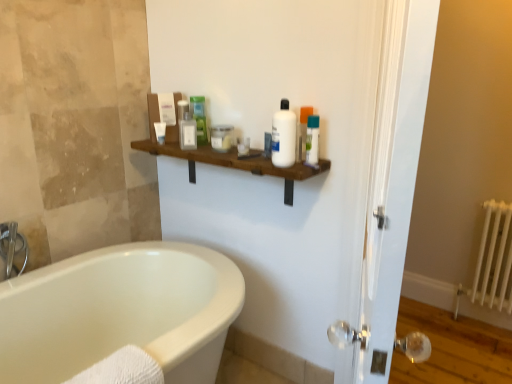
Where is `translucent plastic cup at center, placed as the 3th toiletry when sorted from right to left`? Image resolution: width=512 pixels, height=384 pixels. translucent plastic cup at center, placed as the 3th toiletry when sorted from right to left is located at coordinates (243, 147).

I want to click on white matte tube at upper center, positioned as the 8th toiletry in right-to-left order, so click(160, 132).

What do you see at coordinates (267, 144) in the screenshot? This screenshot has height=384, width=512. I see `translucent plastic bottle at center, positioned as the 2th toiletry in right-to-left order` at bounding box center [267, 144].

This screenshot has width=512, height=384. What are the coordinates of `translucent plastic bottle at center, positioned as the 2th toiletry in right-to-left order` in the screenshot? It's located at (267, 144).

This screenshot has width=512, height=384. What do you see at coordinates (492, 261) in the screenshot? I see `white metal radiator at right` at bounding box center [492, 261].

In order to face matte plastic container at upper center, the seventh toiletry in the right-to-left sequence, should I rotate leftwards or rightwards?

It's best to rotate left around 9.653 degrees.

Locate an element on the screen. The image size is (512, 384). translucent plastic cup at center, acting as the sixth toiletry starting from the left is located at coordinates (243, 147).

Can you confirm if white glossy screen door at right is bigger than white metal radiator at right?

→ Correct, white glossy screen door at right is larger in size than white metal radiator at right.

In the image, there is a white glossy screen door at right. At what (x,y) coordinates should I click in order to perform the action: click on radiator below it (from the image's perspective). Please return your answer as a coordinate pair (x, y). Looking at the image, I should click on (492, 261).

From a real-world perspective, between white glossy screen door at right and white metal radiator at right, who is vertically lower?

white metal radiator at right, from a real-world perspective.

Is the surface of white glossy screen door at right in direct contact with white metal radiator at right?

No, white glossy screen door at right is not in contact with white metal radiator at right.

What's the angular difference between translucent plastic cup at center, placed as the 3th toiletry when sorted from right to left, and white glossy lotion at upper center, which is counted as the first toiletry, starting from the right,'s facing directions?

There is a 0.0168-degree angle between the facing directions of translucent plastic cup at center, placed as the 3th toiletry when sorted from right to left, and white glossy lotion at upper center, which is counted as the first toiletry, starting from the right.

In terms of size, does translucent plastic cup at center, acting as the sixth toiletry starting from the left, appear bigger or smaller than white glossy lotion at upper center, which is counted as the first toiletry, starting from the right?

translucent plastic cup at center, acting as the sixth toiletry starting from the left, is smaller than white glossy lotion at upper center, which is counted as the first toiletry, starting from the right.

There is a white glossy lotion at upper center, which is counted as the first toiletry, starting from the right. Where is `the 2nd toiletry below it (from the image's perspective)`? the 2nd toiletry below it (from the image's perspective) is located at coordinates (243, 147).

Is translucent plastic cup at center, acting as the sixth toiletry starting from the left, shorter than white glossy lotion at upper center, the 8th toiletry when ordered from left to right?

Indeed, translucent plastic cup at center, acting as the sixth toiletry starting from the left, has a lesser height compared to white glossy lotion at upper center, the 8th toiletry when ordered from left to right.

From the image's perspective, between matte glass jar at center, the 5th toiletry positioned from the left, and translucent plastic bottle at center, the 7th toiletry positioned from the left, who is located below?

translucent plastic bottle at center, the 7th toiletry positioned from the left, appears lower in the image.

Is matte glass jar at center, the 5th toiletry positioned from the left, aimed at translucent plastic bottle at center, positioned as the 2th toiletry in right-to-left order?

No.

Looking at this image, from their relative heights in the image, would you say matte glass jar at center, the 5th toiletry positioned from the left, is taller or shorter than translucent plastic bottle at center, the 7th toiletry positioned from the left?

Considering their sizes, matte glass jar at center, the 5th toiletry positioned from the left, has less height than translucent plastic bottle at center, the 7th toiletry positioned from the left.

Based on the photo, would you say matte glass jar at center, the 5th toiletry positioned from the left, contains translucent plastic bottle at center, positioned as the 2th toiletry in right-to-left order?

No, matte glass jar at center, the 5th toiletry positioned from the left, does not contain translucent plastic bottle at center, positioned as the 2th toiletry in right-to-left order.

Is clear plastic container at upper center, marked as the 6th toiletry in a right-to-left arrangement, positioned with its back to brushed metal faucet at left?

clear plastic container at upper center, marked as the 6th toiletry in a right-to-left arrangement, is not turned away from brushed metal faucet at left.

This screenshot has height=384, width=512. In the image, there is a clear plastic container at upper center, marked as the 6th toiletry in a right-to-left arrangement. What are the coordinates of `faucet below it (from a real-world perspective)` in the screenshot? It's located at (12, 248).

Is brushed metal faucet at left completely or partially inside clear plastic container at upper center, marked as the 6th toiletry in a right-to-left arrangement?

Actually, brushed metal faucet at left is outside clear plastic container at upper center, marked as the 6th toiletry in a right-to-left arrangement.

Is clear plastic container at upper center, marked as the 6th toiletry in a right-to-left arrangement, at the right side of brushed metal faucet at left?

Yes, clear plastic container at upper center, marked as the 6th toiletry in a right-to-left arrangement, is to the right of brushed metal faucet at left.

Can you confirm if white glossy lotion at upper center, the 8th toiletry when ordered from left to right, is positioned to the right of white metal radiator at right?

In fact, white glossy lotion at upper center, the 8th toiletry when ordered from left to right, is to the left of white metal radiator at right.

From a real-world perspective, does white glossy lotion at upper center, the 8th toiletry when ordered from left to right, sit lower than white metal radiator at right?

No, from a real-world perspective, white glossy lotion at upper center, the 8th toiletry when ordered from left to right, is not under white metal radiator at right.

Is white glossy lotion at upper center, which is counted as the first toiletry, starting from the right, not near white metal radiator at right?

Yes.

From the image's perspective, which is below, white glossy lotion at upper center, which is counted as the first toiletry, starting from the right, or white metal radiator at right?

white metal radiator at right, from the image's perspective.

Can you confirm if white matte tube at upper center, the first toiletry when ordered from left to right, is smaller than white glossy screen door at right?

Yes, white matte tube at upper center, the first toiletry when ordered from left to right, is smaller than white glossy screen door at right.

Is point (161, 139) positioned before point (355, 192)?

No, it is behind (355, 192).

Is white matte tube at upper center, the first toiletry when ordered from left to right, in contact with white glossy screen door at right?

No, white matte tube at upper center, the first toiletry when ordered from left to right, is not beside white glossy screen door at right.

Identify the location of screen door that appears below the white matte tube at upper center, the first toiletry when ordered from left to right (from a real-world perspective). The height and width of the screenshot is (384, 512). (382, 181).

What's the angular difference between green matte tube at upper center, the fifth toiletry viewed from the right, and clear plastic container at upper center, marked as the 6th toiletry in a right-to-left arrangement,'s facing directions?

The facing directions of green matte tube at upper center, the fifth toiletry viewed from the right, and clear plastic container at upper center, marked as the 6th toiletry in a right-to-left arrangement, are 52 degrees apart.

Is green matte tube at upper center, the fifth toiletry viewed from the right, looking in the opposite direction of clear plastic container at upper center, marked as the 6th toiletry in a right-to-left arrangement?

No, clear plastic container at upper center, marked as the 6th toiletry in a right-to-left arrangement, is not at the back of green matte tube at upper center, the fifth toiletry viewed from the right.

Which object is positioned more to the right, green matte tube at upper center, which is the 4th toiletry in left-to-right order, or clear plastic container at upper center, which appears as the 3th toiletry when viewed from the left?

green matte tube at upper center, which is the 4th toiletry in left-to-right order, is more to the right.

Is green matte tube at upper center, the fifth toiletry viewed from the right, far from clear plastic container at upper center, marked as the 6th toiletry in a right-to-left arrangement?

No, green matte tube at upper center, the fifth toiletry viewed from the right, is not far away from clear plastic container at upper center, marked as the 6th toiletry in a right-to-left arrangement.

This screenshot has height=384, width=512. Identify the location of screen door above the white metal radiator at right (from a real-world perspective). (382, 181).

Locate an element on the screen. The image size is (512, 384). the 2nd toiletry below the white glossy lotion at upper center, which is counted as the first toiletry, starting from the right (from the image's perspective) is located at coordinates (243, 147).

In the scene shown: Based on their spatial positions, is matte plastic container at upper center, the seventh toiletry in the right-to-left sequence, or translucent plastic cup at center, placed as the 3th toiletry when sorted from right to left, closer to white plastic bottle at center?

Based on the image, translucent plastic cup at center, placed as the 3th toiletry when sorted from right to left, appears to be nearer to white plastic bottle at center.

Looking at the image, which one is located further to white matte tube at upper center, the first toiletry when ordered from left to right, white glossy lotion at upper center, which is counted as the first toiletry, starting from the right, or clear plastic container at upper center, which appears as the 3th toiletry when viewed from the left?

white glossy lotion at upper center, which is counted as the first toiletry, starting from the right, is further to white matte tube at upper center, the first toiletry when ordered from left to right.

Considering their positions, is white matte tube at upper center, the first toiletry when ordered from left to right, positioned closer to white glossy lotion at upper center, the 8th toiletry when ordered from left to right, than white metal radiator at right?

The object closer to white glossy lotion at upper center, the 8th toiletry when ordered from left to right, is white matte tube at upper center, the first toiletry when ordered from left to right.

Estimate the real-world distances between objects in this image. Which object is further from white glossy screen door at right, translucent plastic bottle at center, the 7th toiletry positioned from the left, or clear plastic container at upper center, marked as the 6th toiletry in a right-to-left arrangement?

A: clear plastic container at upper center, marked as the 6th toiletry in a right-to-left arrangement, is positioned further to the anchor white glossy screen door at right.

In the scene shown: When comparing their distances from green matte tube at upper center, which is the 4th toiletry in left-to-right order, does white glossy lotion at upper center, the 8th toiletry when ordered from left to right, or white plastic bottle at center seem closer?

Based on the image, white plastic bottle at center appears to be nearer to green matte tube at upper center, which is the 4th toiletry in left-to-right order.

Looking at the image, which one is located further to translucent plastic bottle at center, positioned as the 2th toiletry in right-to-left order, white plastic bottle at center or white glossy lotion at upper center, the 8th toiletry when ordered from left to right?

white glossy lotion at upper center, the 8th toiletry when ordered from left to right.

Estimate the real-world distances between objects in this image. Which object is closer to clear plastic container at upper center, which appears as the 3th toiletry when viewed from the left, white glossy lotion at upper center, the 8th toiletry when ordered from left to right, or white plastic bottle at center?

Based on the image, white plastic bottle at center appears to be nearer to clear plastic container at upper center, which appears as the 3th toiletry when viewed from the left.

From the image, which object appears to be farther from brown wooden shelf at upper center, white glossy screen door at right or matte plastic container at upper center, the seventh toiletry in the right-to-left sequence?

Based on the image, white glossy screen door at right appears to be further to brown wooden shelf at upper center.

I want to click on balustrade located between clear plastic container at upper center, which appears as the 3th toiletry when viewed from the left, and translucent plastic bottle at center, the 7th toiletry positioned from the left, in the left-right direction, so click(234, 163).

Locate an element on the screen. The width and height of the screenshot is (512, 384). cleaning product between translucent plastic cup at center, placed as the 3th toiletry when sorted from right to left, and white metal radiator at right from left to right is located at coordinates (284, 136).

Locate an element on the screen. Image resolution: width=512 pixels, height=384 pixels. cleaning product situated between brown wooden shelf at upper center and white glossy lotion at upper center, which is counted as the first toiletry, starting from the right, from left to right is located at coordinates (284, 136).

Locate an element on the screen. Image resolution: width=512 pixels, height=384 pixels. cleaning product located between white matte tube at upper center, positioned as the 8th toiletry in right-to-left order, and white glossy lotion at upper center, the 8th toiletry when ordered from left to right, in the left-right direction is located at coordinates (284, 136).